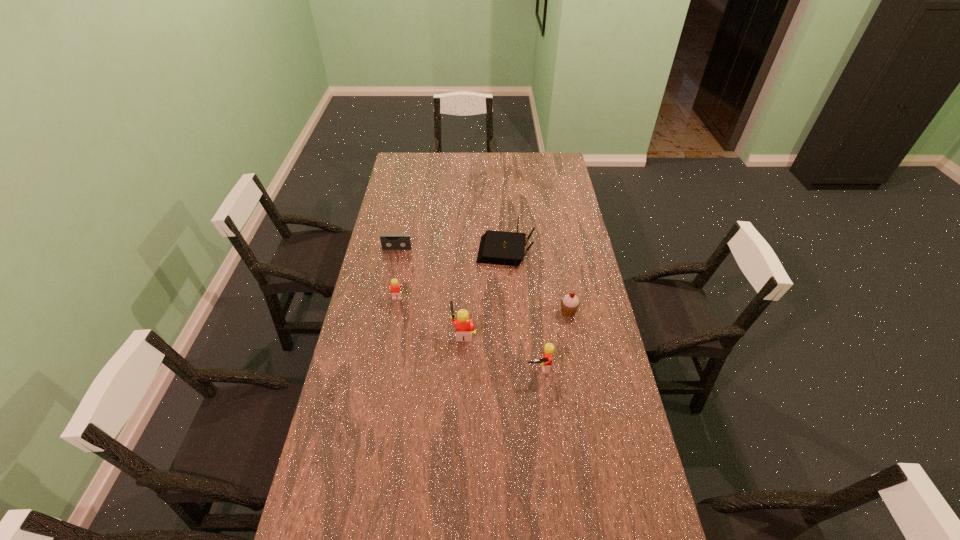
Please point a spot to add another Lego on the right. Please provide its 2D coordinates. Your answer should be formatted as a tuple, i.e. [(x, y)], where the tuple contains the x and y coordinates of a point satisfying the conditions above.

[(626, 409)]